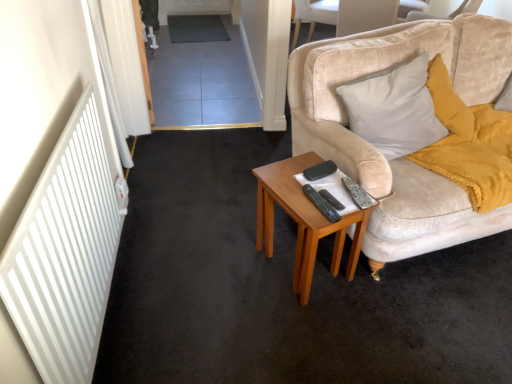
Locate an element on the screen. The height and width of the screenshot is (384, 512). velvet beige pillow at right is located at coordinates (394, 108).

Image resolution: width=512 pixels, height=384 pixels. What do you see at coordinates (303, 221) in the screenshot? I see `woodenobject at center` at bounding box center [303, 221].

Locate an element on the screen. velvet beige chair at upper center is located at coordinates (314, 15).

Measure the distance between black plastic remote control at center, which ranks as the 2th remote control in left-to-right order, and camera.

The depth of black plastic remote control at center, which ranks as the 2th remote control in left-to-right order, is 1.66 meters.

What do you see at coordinates (357, 193) in the screenshot? I see `silver metallic remote control at right, positioned as the 3th remote control in left-to-right order` at bounding box center [357, 193].

This screenshot has height=384, width=512. Find the location of `black plastic remote control at center, the 1th remote control when ordered from left to right`. black plastic remote control at center, the 1th remote control when ordered from left to right is located at coordinates (321, 204).

What are the coordinates of `dark gray carpet at center` in the screenshot? It's located at (196, 28).

Where is `the 1st remote control counting from the left side of the velvet beige chair at upper center`? The image size is (512, 384). the 1st remote control counting from the left side of the velvet beige chair at upper center is located at coordinates (357, 193).

Considering the sizes of silver metallic remote control at right, the 1th remote control in the right-to-left sequence, and velvet beige chair at upper center in the image, is silver metallic remote control at right, the 1th remote control in the right-to-left sequence, taller or shorter than velvet beige chair at upper center?

Clearly, silver metallic remote control at right, the 1th remote control in the right-to-left sequence, is shorter compared to velvet beige chair at upper center.

Would you say silver metallic remote control at right, the 1th remote control in the right-to-left sequence, is outside velvet beige chair at upper center?

Indeed, silver metallic remote control at right, the 1th remote control in the right-to-left sequence, is completely outside velvet beige chair at upper center.

Identify the location of the 1st remote control to the left of the velvet beige chair at upper center, counting from the anchor's position. This screenshot has height=384, width=512. (357, 193).

In the scene shown: Is silver metallic remote control at right, the 1th remote control in the right-to-left sequence, surrounded by velvet beige chair at upper center?

Actually, silver metallic remote control at right, the 1th remote control in the right-to-left sequence, is outside velvet beige chair at upper center.

From the picture: Is velvet beige chair at upper center facing towards silver metallic remote control at right, positioned as the 3th remote control in left-to-right order?

No, velvet beige chair at upper center is not oriented towards silver metallic remote control at right, positioned as the 3th remote control in left-to-right order.

From a real-world perspective, does velvet beige chair at upper center sit lower than silver metallic remote control at right, positioned as the 3th remote control in left-to-right order?

Yes.

From a real-world perspective, which is physically above, silver metallic remote control at right, the 1th remote control in the right-to-left sequence, or velvet beige pillow at right?

From a 3D spatial view, velvet beige pillow at right is above.

Is point (358, 204) closer or farther from the camera than point (410, 122)?

Point (358, 204).

Is dark gray carpet at center to the left of velvet beige pillow at right from the viewer's perspective?

Correct, you'll find dark gray carpet at center to the left of velvet beige pillow at right.

Which is correct: dark gray carpet at center is inside velvet beige pillow at right, or outside of it?

dark gray carpet at center is located beyond the bounds of velvet beige pillow at right.

This screenshot has height=384, width=512. I want to click on plain on the left of the velvet beige pillow at right, so click(196, 28).

Measure the distance between dark gray carpet at center and velvet beige pillow at right.

The distance of dark gray carpet at center from velvet beige pillow at right is 3.30 meters.

From a real-world perspective, which is physically above, velvet beige chair at upper center or dark gray carpet at center?

From a 3D spatial view, velvet beige chair at upper center is above.

Can you confirm if velvet beige chair at upper center is bigger than dark gray carpet at center?

Yes.

Who is taller, velvet beige chair at upper center or dark gray carpet at center?

velvet beige chair at upper center is taller.

Is silver metallic remote control at right, the 1th remote control in the right-to-left sequence, far from black plastic remote control at center, which is the second remote control from right to left?

No, there isn't a large distance between silver metallic remote control at right, the 1th remote control in the right-to-left sequence, and black plastic remote control at center, which is the second remote control from right to left.

Is silver metallic remote control at right, the 1th remote control in the right-to-left sequence, bigger or smaller than black plastic remote control at center, which is the second remote control from right to left?

silver metallic remote control at right, the 1th remote control in the right-to-left sequence, is bigger than black plastic remote control at center, which is the second remote control from right to left.

In terms of height, does silver metallic remote control at right, the 1th remote control in the right-to-left sequence, look taller or shorter compared to black plastic remote control at center, which ranks as the 2th remote control in left-to-right order?

silver metallic remote control at right, the 1th remote control in the right-to-left sequence, is taller than black plastic remote control at center, which ranks as the 2th remote control in left-to-right order.

Which of these two, velvet beige pillow at right or black plastic remote control at center, marked as the 3th remote control in a right-to-left arrangement, is wider?

velvet beige pillow at right is wider.

From the image's perspective, is velvet beige pillow at right above black plastic remote control at center, the 1th remote control when ordered from left to right?

Correct, velvet beige pillow at right appears higher than black plastic remote control at center, the 1th remote control when ordered from left to right, in the image.

What's the angular difference between velvet beige pillow at right and black plastic remote control at center, marked as the 3th remote control in a right-to-left arrangement,'s facing directions?

The angle between the facing direction of velvet beige pillow at right and the facing direction of black plastic remote control at center, marked as the 3th remote control in a right-to-left arrangement, is 1.29 degrees.

Is velvet beige pillow at right outside of black plastic remote control at center, the 1th remote control when ordered from left to right?

That's correct, velvet beige pillow at right is outside of black plastic remote control at center, the 1th remote control when ordered from left to right.

Identify the location of the 1st remote control in front when counting from the velvet beige chair at upper center. Image resolution: width=512 pixels, height=384 pixels. (357, 193).

The image size is (512, 384). Identify the location of chair on the right side of silver metallic remote control at right, the 1th remote control in the right-to-left sequence. [314, 15].

Estimate the real-world distances between objects in this image. Which object is further from dark gray carpet at center, black plastic remote control at center, the 1th remote control when ordered from left to right, or velvet beige pillow at right?

Based on the image, black plastic remote control at center, the 1th remote control when ordered from left to right, appears to be further to dark gray carpet at center.

From the image, which object appears to be farther from velvet beige chair at upper center, woodenobject at center or black plastic remote control at center, which ranks as the 2th remote control in left-to-right order?

black plastic remote control at center, which ranks as the 2th remote control in left-to-right order.

From the image, which object appears to be nearer to dark gray carpet at center, black plastic remote control at center, which is the second remote control from right to left, or woodenobject at center?

woodenobject at center.

Based on their spatial positions, is black plastic remote control at center, which is the second remote control from right to left, or velvet beige pillow at right closer to velvet beige chair at upper center?

velvet beige pillow at right is closer to velvet beige chair at upper center.

From the image, which object appears to be farther from black plastic remote control at center, marked as the 3th remote control in a right-to-left arrangement, black plastic remote control at center, which ranks as the 2th remote control in left-to-right order, or woodenobject at center?

Result: Based on the image, woodenobject at center appears to be further to black plastic remote control at center, marked as the 3th remote control in a right-to-left arrangement.

Estimate the real-world distances between objects in this image. Which object is closer to black plastic remote control at center, which ranks as the 2th remote control in left-to-right order, silver metallic remote control at right, the 1th remote control in the right-to-left sequence, or black plastic remote control at center, the 1th remote control when ordered from left to right?

black plastic remote control at center, the 1th remote control when ordered from left to right, lies closer to black plastic remote control at center, which ranks as the 2th remote control in left-to-right order, than the other object.

When comparing their distances from black plastic remote control at center, which is the second remote control from right to left, does black plastic remote control at center, the 1th remote control when ordered from left to right, or woodenobject at center seem closer?

black plastic remote control at center, the 1th remote control when ordered from left to right, is positioned closer to the anchor black plastic remote control at center, which is the second remote control from right to left.

Estimate the real-world distances between objects in this image. Which object is further from velvet beige chair at upper center, black plastic remote control at center, the 1th remote control when ordered from left to right, or black plastic remote control at center, which ranks as the 2th remote control in left-to-right order?

Based on the image, black plastic remote control at center, which ranks as the 2th remote control in left-to-right order, appears to be further to velvet beige chair at upper center.

Where is `remote control between black plastic remote control at center, marked as the 3th remote control in a right-to-left arrangement, and silver metallic remote control at right, the 1th remote control in the right-to-left sequence, in the horizontal direction`? remote control between black plastic remote control at center, marked as the 3th remote control in a right-to-left arrangement, and silver metallic remote control at right, the 1th remote control in the right-to-left sequence, in the horizontal direction is located at coordinates (331, 200).

Find the location of `pillow between silver metallic remote control at right, the 1th remote control in the right-to-left sequence, and velvet beige chair at upper center in the front-back direction`. pillow between silver metallic remote control at right, the 1th remote control in the right-to-left sequence, and velvet beige chair at upper center in the front-back direction is located at coordinates (394, 108).

The width and height of the screenshot is (512, 384). Find the location of `pillow between black plastic remote control at center, which is the second remote control from right to left, and dark gray carpet at center in the front-back direction`. pillow between black plastic remote control at center, which is the second remote control from right to left, and dark gray carpet at center in the front-back direction is located at coordinates (394, 108).

The height and width of the screenshot is (384, 512). I want to click on remote control positioned between black plastic remote control at center, which ranks as the 2th remote control in left-to-right order, and dark gray carpet at center from near to far, so click(357, 193).